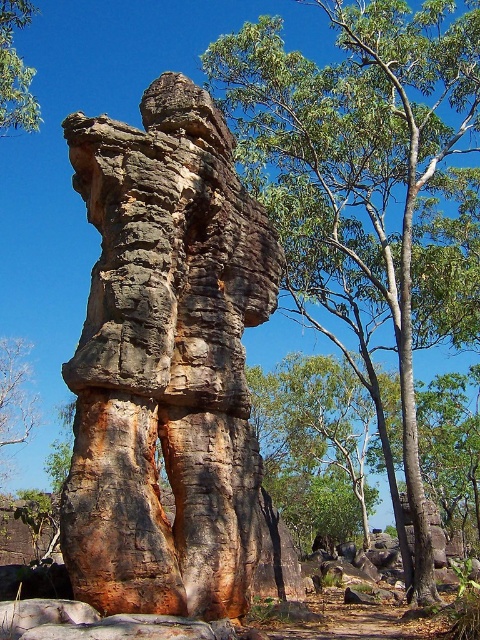
From the picture: Who is shorter, rustic stone sculpture at center or green leafy tree at upper left?

green leafy tree at upper left is shorter.

Is rustic stone sculpture at center to the left of green leafy tree at upper left from the viewer's perspective?

No, rustic stone sculpture at center is not to the left of green leafy tree at upper left.

The image size is (480, 640). Identify the location of rustic stone sculpture at center. (166, 362).

Find the location of a particular element. rustic stone sculpture at center is located at coordinates (166, 362).

Can you confirm if rustic stone sculpture at center is positioned to the left of green leafy tree at center?

Yes, rustic stone sculpture at center is to the left of green leafy tree at center.

Is rustic stone sculpture at center above green leafy tree at center?

Incorrect, rustic stone sculpture at center is not positioned above green leafy tree at center.

Between point (232, 563) and point (288, 93), which one is positioned behind?

The point (288, 93) is more distant.

Where is `rustic stone sculpture at center`? The image size is (480, 640). rustic stone sculpture at center is located at coordinates (166, 362).

Is green leafy tree at center smaller than green leafy tree at upper left?

Actually, green leafy tree at center might be larger than green leafy tree at upper left.

Who is taller, green leafy tree at center or green leafy tree at upper left?

green leafy tree at center is taller.

Is point (468, 12) positioned before point (14, 92)?

No, (468, 12) is further to viewer.

Locate an element on the screen. This screenshot has height=640, width=480. green leafy tree at center is located at coordinates (360, 154).